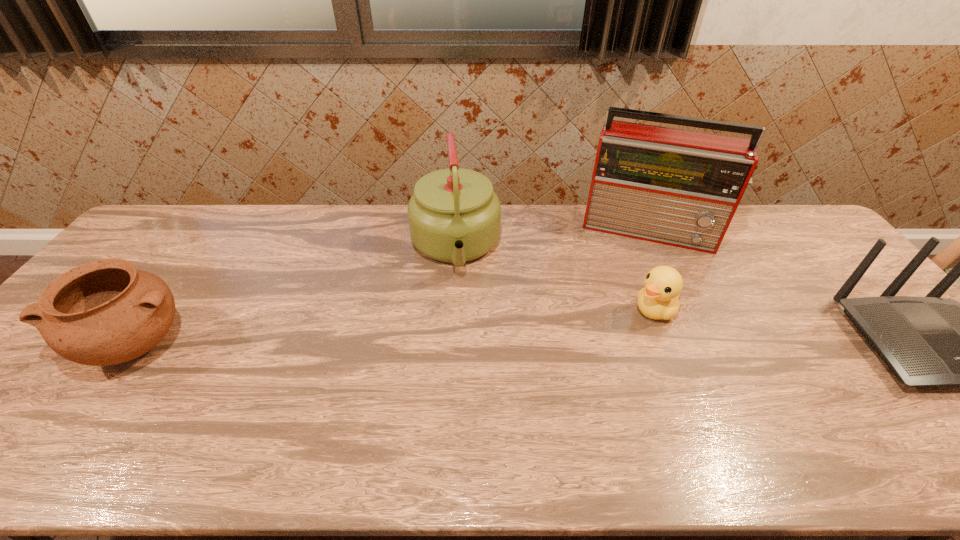
You are a GUI agent. You are given a task and a screenshot of the screen. Output one action in this format:
    pyautogui.click(x=<x>, y=<y>)
    Task: Click on the free space that satisfies the following two spatial constraints: 1. on the back side of the fourth object from right to left; 2. on the left side of the radio receiver
    The width and height of the screenshot is (960, 540).
    Given the screenshot: What is the action you would take?
    pyautogui.click(x=457, y=228)

Where is `vacant area that satisfies the following two spatial constraints: 1. on the front side of the kettle; 2. on the right side of the duck`? The height and width of the screenshot is (540, 960). vacant area that satisfies the following two spatial constraints: 1. on the front side of the kettle; 2. on the right side of the duck is located at coordinates (451, 310).